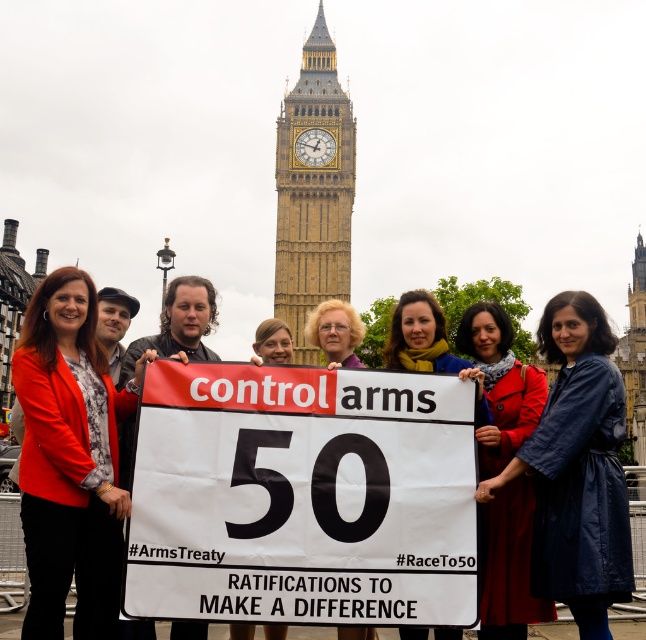
Does point (317, 476) lie in front of point (307, 244)?

Yes.

Between white paper sign at center and gold/yellow metal big ben at upper center, which one appears on the left side from the viewer's perspective?

Positioned to the left is white paper sign at center.

Identify the location of white paper sign at center. (302, 497).

Where is `white paper sign at center`? white paper sign at center is located at coordinates (302, 497).

Does blue fabric coat at center have a lesser height compared to gold/yellow metal big ben at upper center?

Indeed, blue fabric coat at center has a lesser height compared to gold/yellow metal big ben at upper center.

Is blue fabric coat at center further to the viewer compared to gold/yellow metal big ben at upper center?

No, blue fabric coat at center is closer to the viewer.

You are a GUI agent. You are given a task and a screenshot of the screen. Output one action in this format:
    pyautogui.click(x=<x>, y=<y>)
    Task: Click on the blue fabric coat at center
    Image resolution: width=646 pixels, height=640 pixels.
    Given the screenshot: What is the action you would take?
    pyautogui.click(x=578, y=468)

Based on the photo, is white paper sign at center positioned behind blue fabric coat at center?

No.

Is white paper sign at center smaller than blue fabric coat at center?

Yes, white paper sign at center is smaller than blue fabric coat at center.

Who is more distant from viewer, (380, 620) or (545, 342)?

The point (545, 342) is more distant.

Find the location of a particular element. white paper sign at center is located at coordinates coord(302,497).